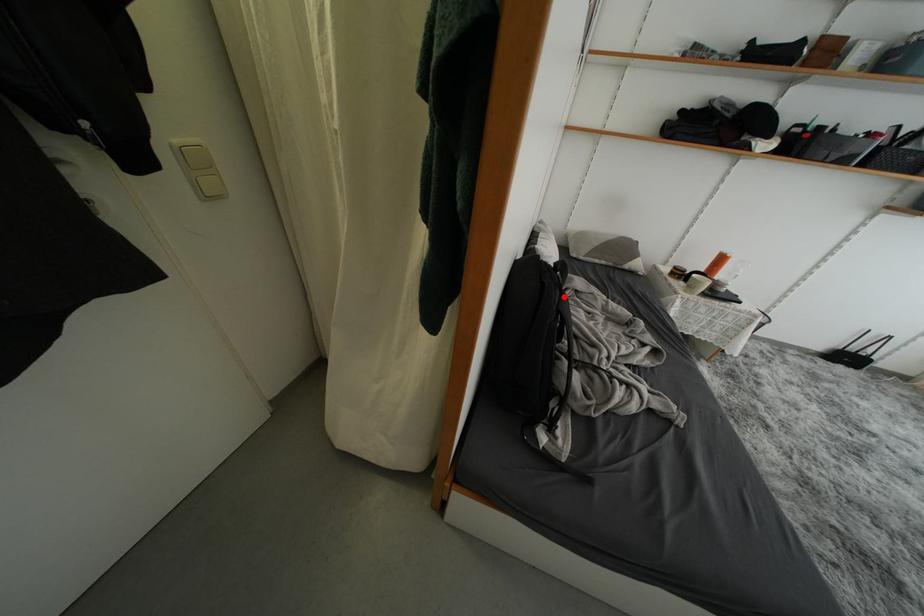
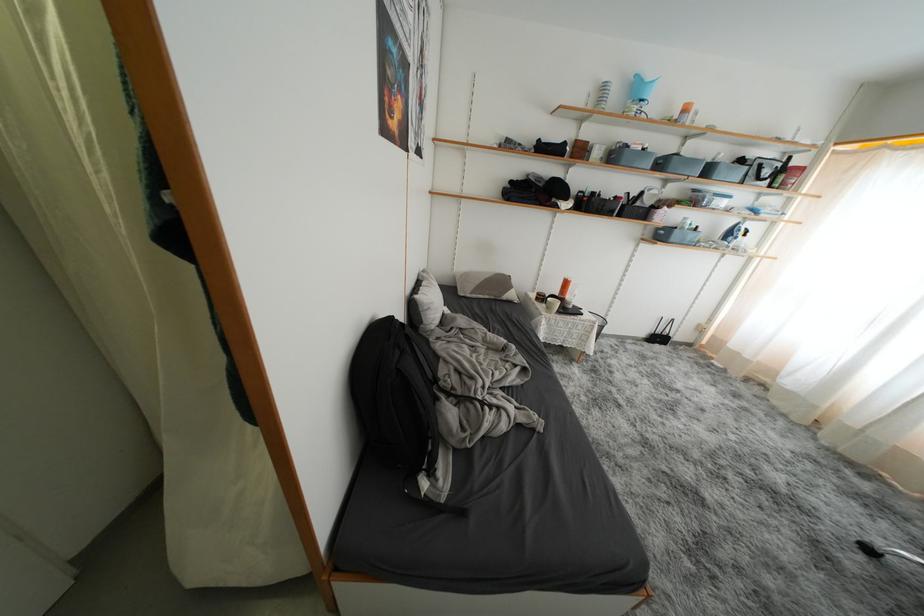
The point at the highlighted location is marked in the first image. Where is the corresponding point in the second image?

(404, 357)